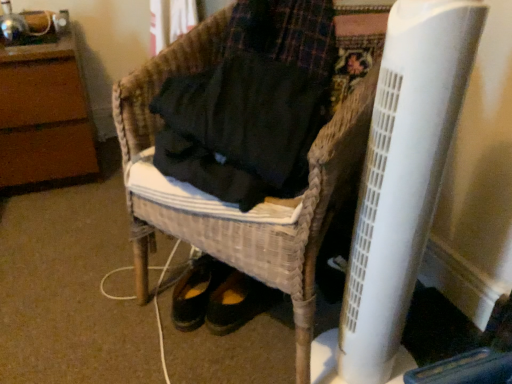
Question: In terms of height, does woven wicker chair at center, arranged as the 2th furniture when viewed from the left, look taller or shorter compared to brown wood dresser at upper left, the first furniture in the left-to-right sequence?

Choices:
 (A) short
 (B) tall

Answer: (B)

Question: Considering the positions of woven wicker chair at center, arranged as the 2th furniture when viewed from the left, and brown wood dresser at upper left, the first furniture in the left-to-right sequence, in the image, is woven wicker chair at center, arranged as the 2th furniture when viewed from the left, bigger or smaller than brown wood dresser at upper left, the first furniture in the left-to-right sequence,?

Choices:
 (A) big
 (B) small

Answer: (A)

Question: Which is nearer to the brown wood dresser at upper left, positioned as the second furniture in right-to-left order?

Choices:
 (A) woven wicker chair at center, which ranks as the first furniture in front-to-back order
 (B) white plastic radiator at lower right

Answer: (A)

Question: Which of these objects is positioned farthest from the woven wicker chair at center, arranged as the 2th furniture when viewed from the left?

Choices:
 (A) white plastic radiator at lower right
 (B) brown wood dresser at upper left, positioned as the second furniture in front-to-back order

Answer: (B)